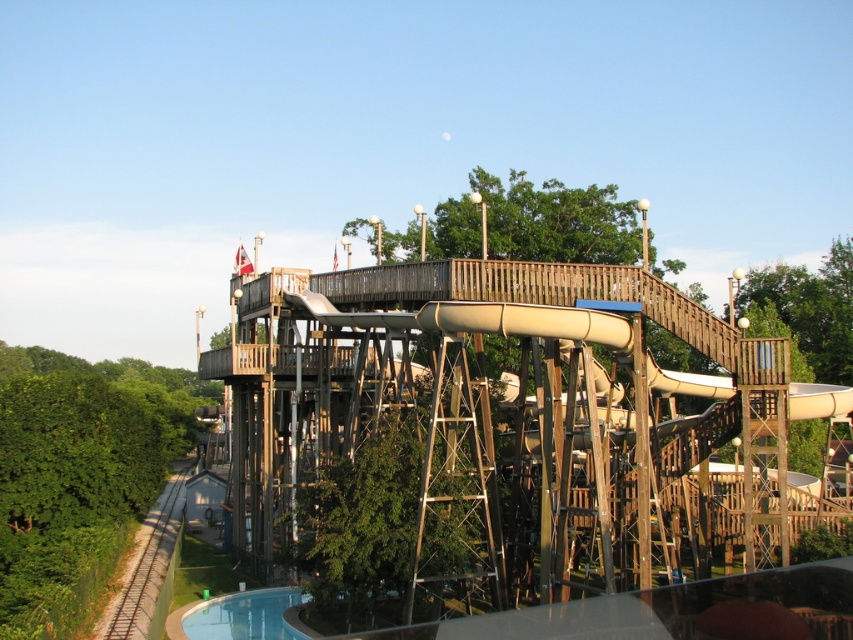
Question: Among these points, which one is farthest from the camera?

Choices:
 (A) (669, 618)
 (B) (219, 380)

Answer: (B)

Question: Is wooden water slide at upper center positioned in front of blue glossy pool at lower center?

Choices:
 (A) no
 (B) yes

Answer: (A)

Question: Which of the following is the closest to the observer?

Choices:
 (A) pos(518,611)
 (B) pos(248,376)

Answer: (A)

Question: Is wooden water slide at upper center bigger than blue glossy pool at lower center?

Choices:
 (A) yes
 (B) no

Answer: (A)

Question: Considering the relative positions of wooden water slide at upper center and blue glossy pool at lower center in the image provided, where is wooden water slide at upper center located with respect to blue glossy pool at lower center?

Choices:
 (A) above
 (B) below

Answer: (A)